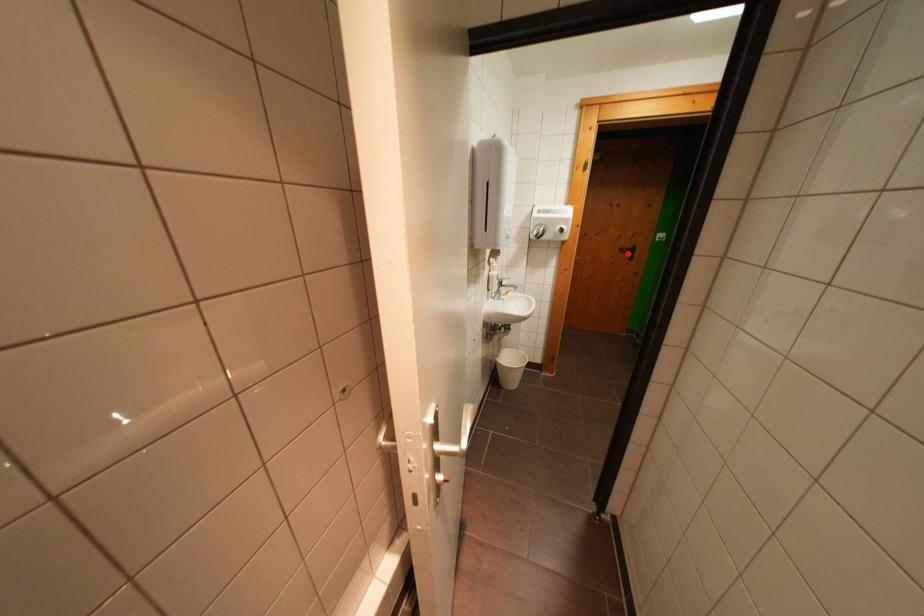
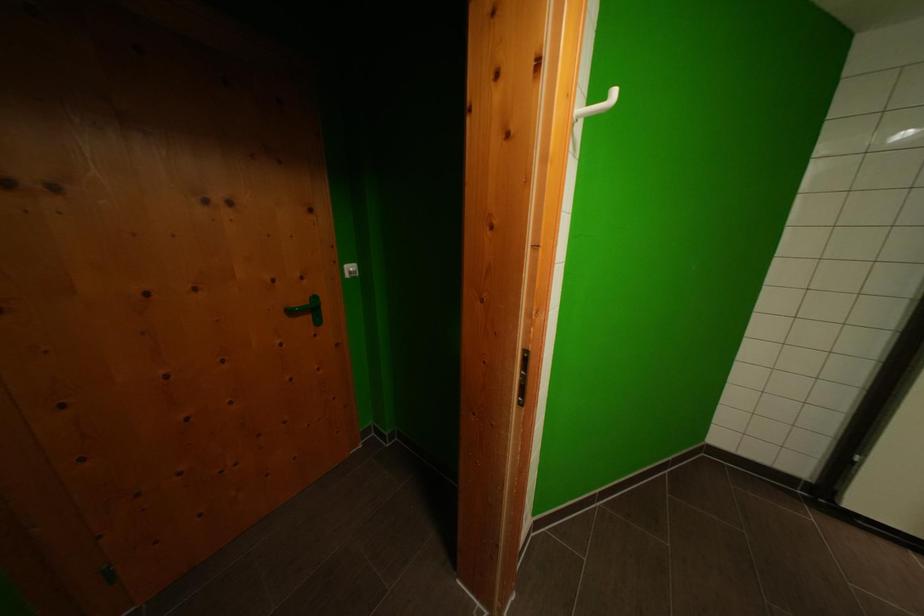
Question: I am providing you with two images of the same scene from different viewpoints. A red point is marked on the first image. At the location where the point appears in image 1, is it still visible in image 2?

Choices:
 (A) Yes
 (B) No

Answer: (A)